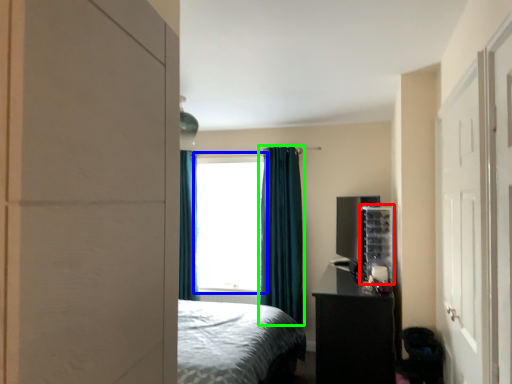
Question: Based on their relative distances, which object is farther from shelf (highlighted by a red box)? Choose from window (highlighted by a blue box) and curtain (highlighted by a green box).

Choices:
 (A) window
 (B) curtain

Answer: (A)